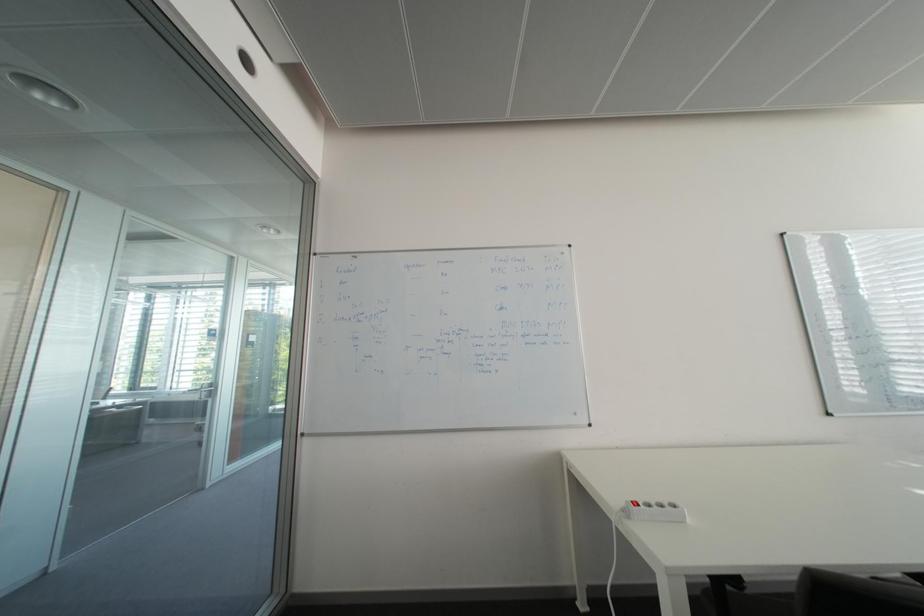
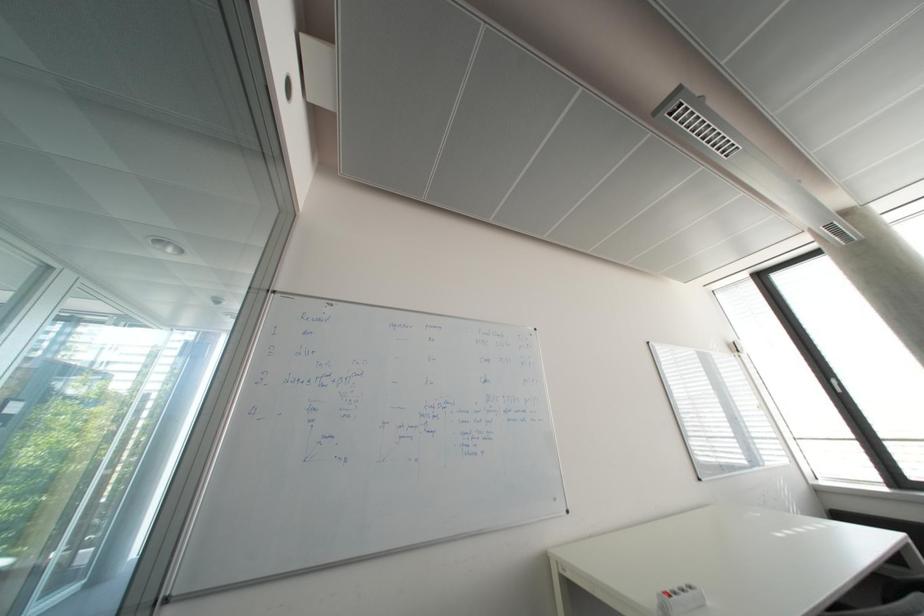
Question: What movement of the cameraman would produce the second image?

Choices:
 (A) Left
 (B) Right
 (C) Forward
 (D) Backward

Answer: (A)